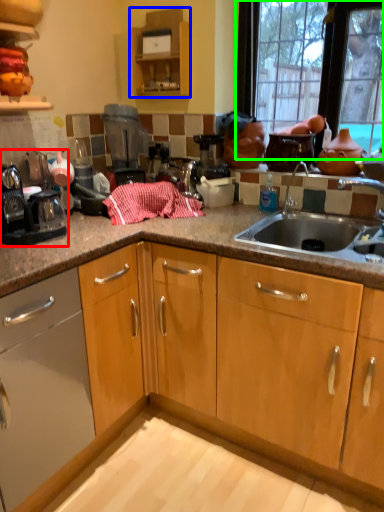
Question: Which is nearer to the appliance (highlighted by a red box)? cabinetry (highlighted by a blue box) or window (highlighted by a green box).

Choices:
 (A) cabinetry
 (B) window

Answer: (A)